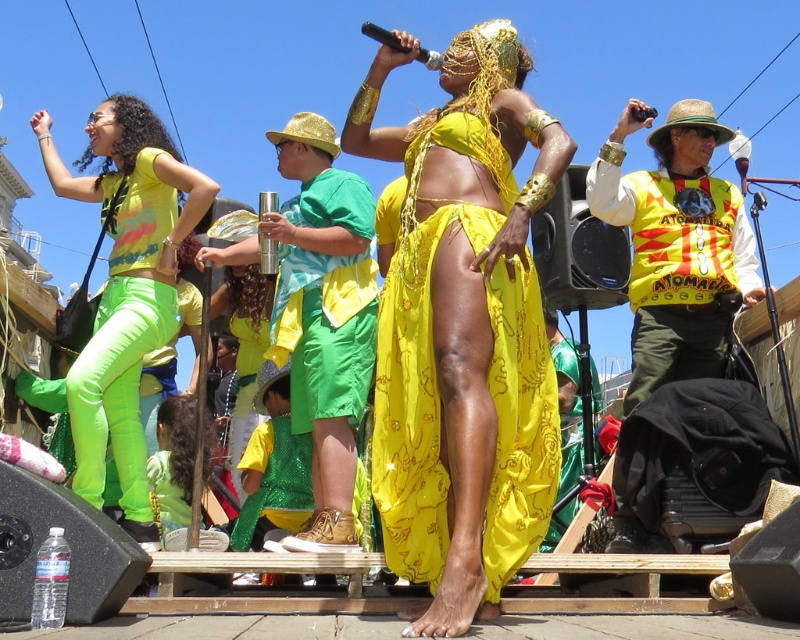
Is neon green pants at left bigger than green fabric at center?

Yes, neon green pants at left is bigger than green fabric at center.

Which is behind, point (78, 394) or point (324, 387)?

Positioned behind is point (324, 387).

The height and width of the screenshot is (640, 800). In order to click on neon green pants at left in this screenshot , I will do `click(126, 289)`.

Between shiny yellow fabric at center and neon green pants at left, which one has more height?

neon green pants at left

Can you confirm if shiny yellow fabric at center is positioned above neon green pants at left?

Actually, shiny yellow fabric at center is below neon green pants at left.

Consider the image. Who is more forward, (524, 561) or (134, 467)?

Point (524, 561) is in front.

This screenshot has width=800, height=640. Find the location of `shiny yellow fabric at center`. shiny yellow fabric at center is located at coordinates (422, 342).

Where is `shiny yellow fabric at center`? This screenshot has width=800, height=640. shiny yellow fabric at center is located at coordinates (422, 342).

Based on the photo, can you confirm if shiny yellow fabric at center is positioned below green fabric at center?

Indeed, shiny yellow fabric at center is positioned under green fabric at center.

Describe the element at coordinates (422, 342) in the screenshot. I see `shiny yellow fabric at center` at that location.

Locate an element on the screen. shiny yellow fabric at center is located at coordinates (422, 342).